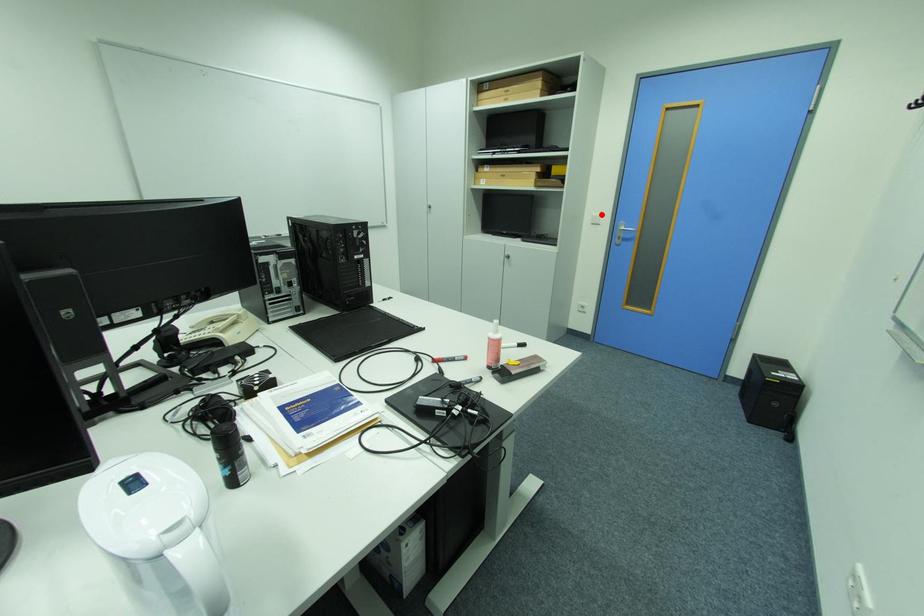
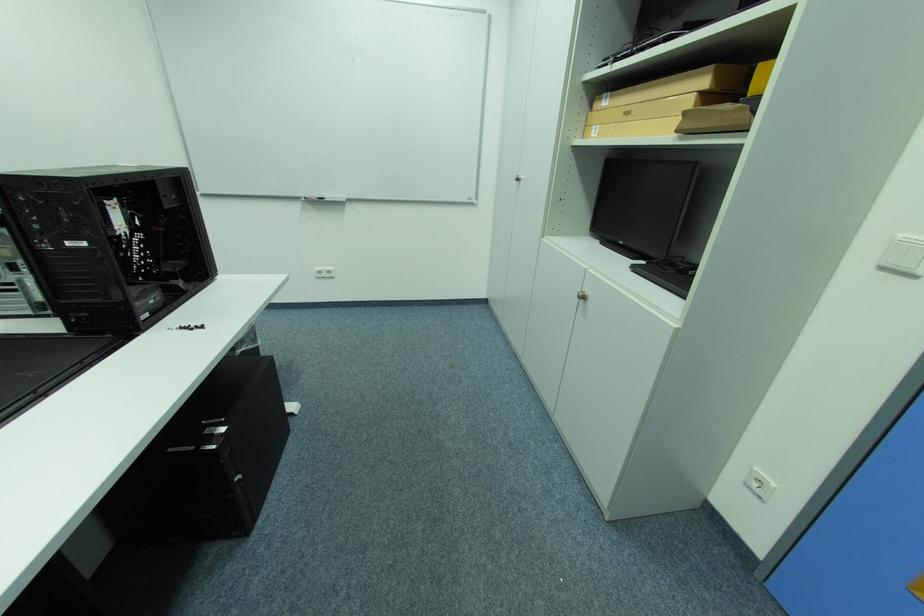
Question: I am providing you with two images of the same scene from different viewpoints. Image1 has a red point marked. In image2, the corresponding 3D location appears at what relative position? Reply with the corresponding letter.

Choices:
 (A) Closer
 (B) Farther

Answer: (B)